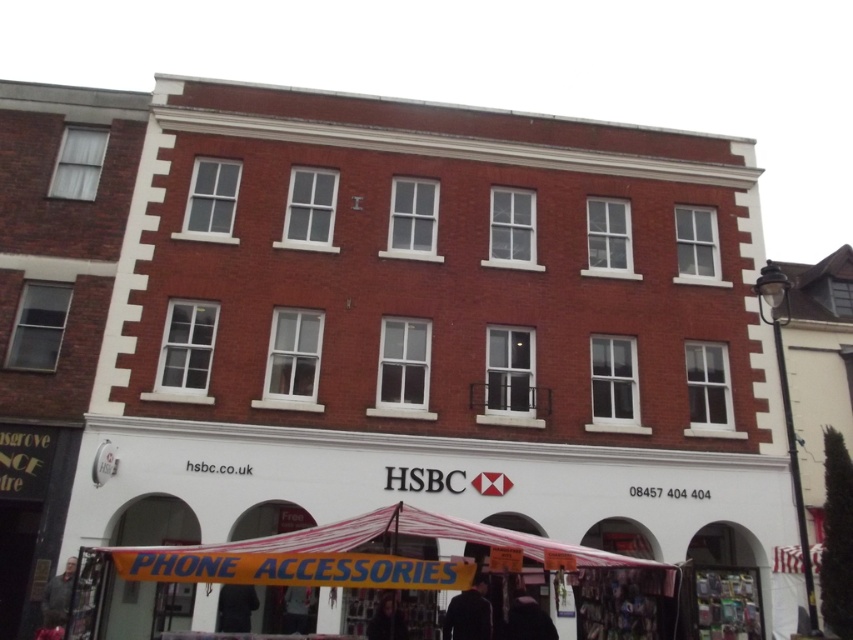
You are a pedestrian standing in front of the HSBC bank branch. You notice a yellow fabric canopy at lower center and a dark hair at lower center. Which object is wider from your perspective?

The yellow fabric canopy at lower center might be wider than dark hair at lower center.

You are a window cleaner with a ladder that can reach up to 2 meters. You need to clean the HSBC bank branch entrance and the adjacent store sign. The dark blue fabric at lower center and the black fabric at lower center are blocking your access. Which fabric should you move first to ensure you can reach both areas safely?

The dark blue fabric at lower center is bigger than the black fabric at lower center, so you should move the dark blue fabric at lower center first to create enough space for the ladder and access both areas safely.

You are a pedestrian standing in front of the HSBC bank entrance. You see a dark gray jacket at lower left and a dark hair at lower center. Which object is closer to the ground?

The dark gray jacket at lower left is positioned under dark hair at lower center, so the dark gray jacket at lower left is closer to the ground.